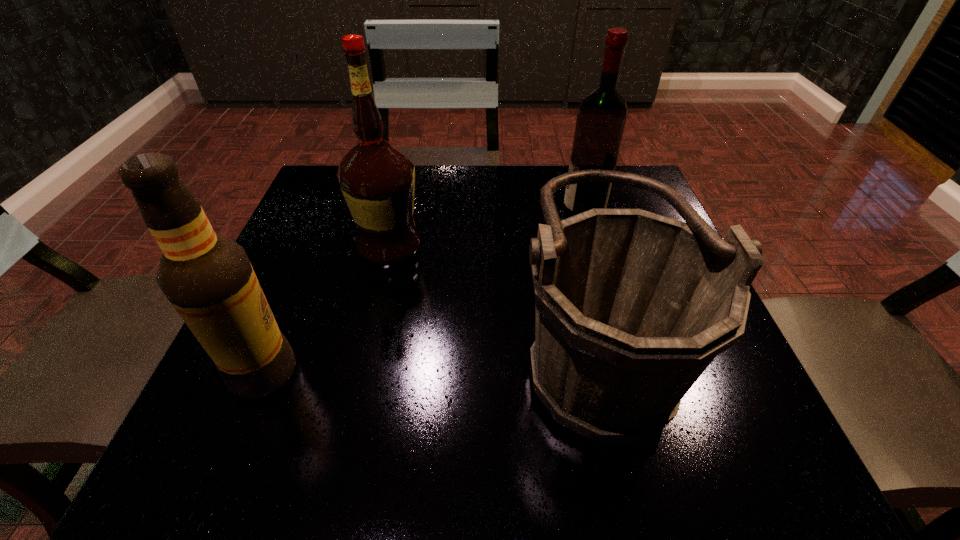
This screenshot has width=960, height=540. I want to click on the second object from left to right, so click(x=377, y=180).

Identify the location of the second farthest object. This screenshot has height=540, width=960. (377, 180).

This screenshot has width=960, height=540. I want to click on the farthest alcohol, so click(x=601, y=117).

Locate an element on the screen. This screenshot has width=960, height=540. the farthest object is located at coordinates (601, 117).

Where is `the nearest alcohol`? Image resolution: width=960 pixels, height=540 pixels. the nearest alcohol is located at coordinates (209, 280).

The width and height of the screenshot is (960, 540). I want to click on the leftmost object, so click(209, 280).

Locate an element on the screen. This screenshot has width=960, height=540. the shortest object is located at coordinates (631, 307).

Locate an element on the screen. free spot located on the label of the second farthest alcohol is located at coordinates (492, 248).

I want to click on vacant area situated on the front and back of the farthest object, so click(x=408, y=214).

This screenshot has height=540, width=960. I want to click on vacant space located on the front and back of the farthest object, so click(425, 214).